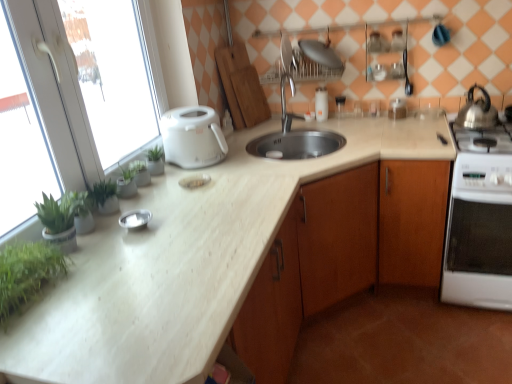
Identify the location of spots to the right of silver metallic faucet at center. The width and height of the screenshot is (512, 384). (327, 129).